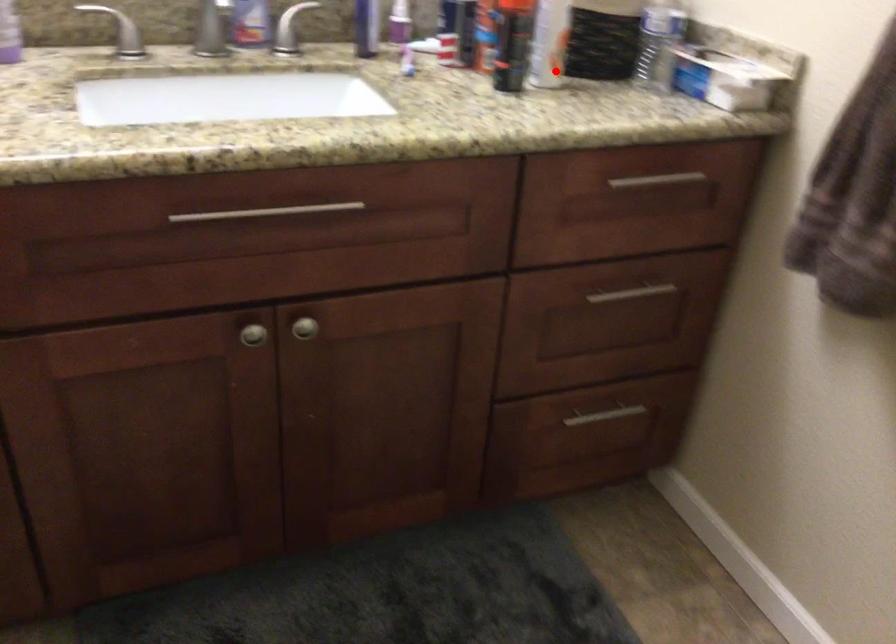
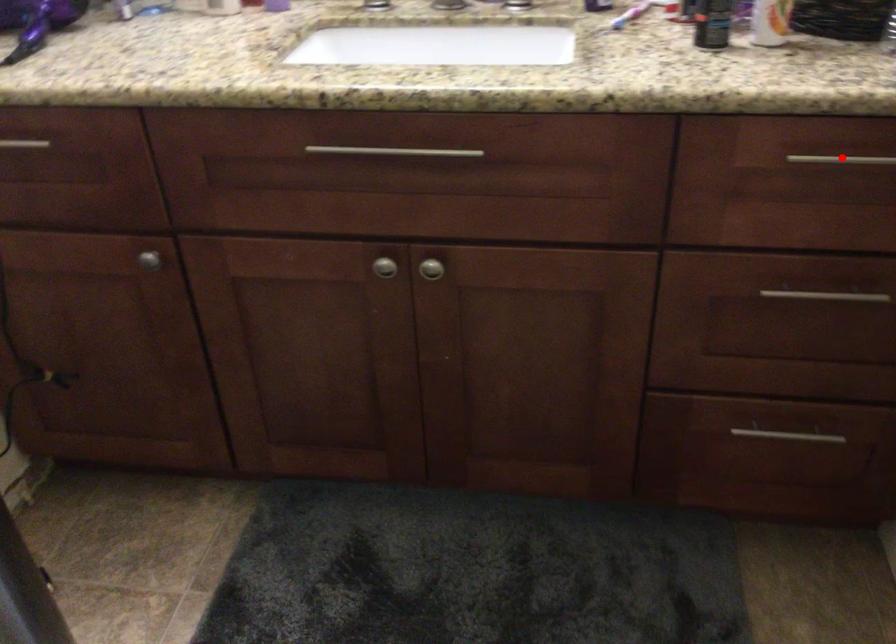
I am providing you with two images of the same scene from different viewpoints. A red point is marked on the first image and another point is marked on the second image. Are the points marked in image1 and image2 representing the same 3D position?

No